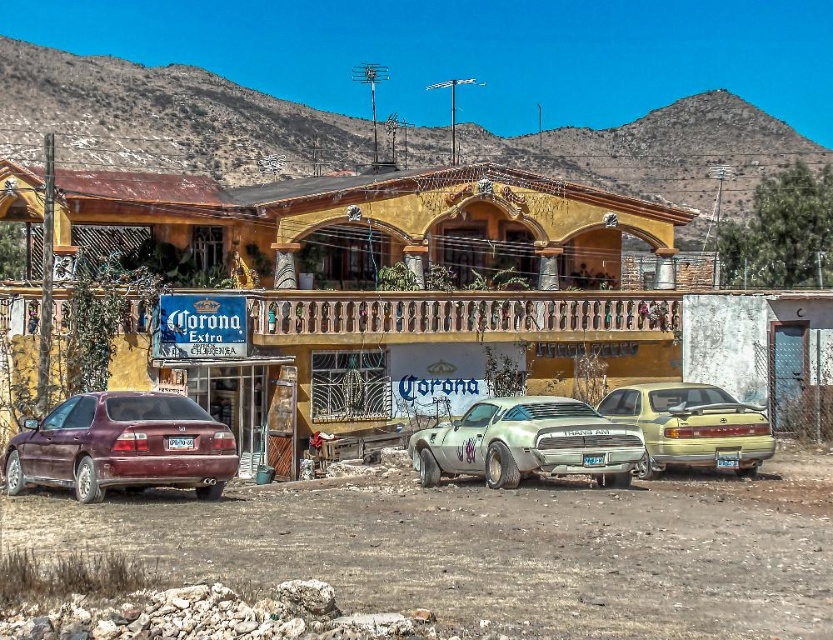
Looking at this image, does matte yellow building at center lie in front of satin burgundy sedan at lower left?

No, matte yellow building at center is further to the viewer.

How much distance is there between matte yellow building at center and satin burgundy sedan at lower left?

matte yellow building at center and satin burgundy sedan at lower left are 16.56 meters apart from each other.

Is point (300, 285) more distant than point (222, 451)?

Yes, point (300, 285) is behind point (222, 451).

Where is `matte yellow building at center`? The height and width of the screenshot is (640, 833). matte yellow building at center is located at coordinates (447, 310).

Does matte yellow building at center appear under silver metallic muscle car at center?

No, matte yellow building at center is not below silver metallic muscle car at center.

Is point (602, 240) behind point (471, 449)?

That is True.

The height and width of the screenshot is (640, 833). Find the location of `matte yellow building at center`. matte yellow building at center is located at coordinates (447, 310).

Where is `matte yellow building at center`? Image resolution: width=833 pixels, height=640 pixels. matte yellow building at center is located at coordinates (447, 310).

From the picture: Is satin burgundy sedan at lower left below metallic gold sedan at right?

Yes.

Which of these two, satin burgundy sedan at lower left or metallic gold sedan at right, stands taller?

Standing taller between the two is satin burgundy sedan at lower left.

Is point (223, 449) behind point (697, 392)?

No, it is in front of (697, 392).

Identify the location of satin burgundy sedan at lower left. (122, 445).